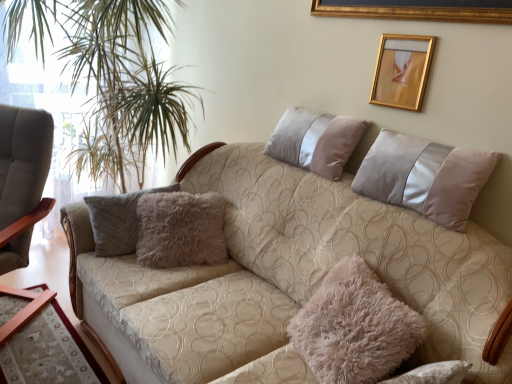
Question: Is gold metallic picture frame at upper right to the left of silky beige pillow at upper right, the 2th pillow in the bottom-to-top sequence, from the viewer's perspective?

Choices:
 (A) no
 (B) yes

Answer: (B)

Question: Is gold metallic picture frame at upper right not within silky beige pillow at upper right, the 2th pillow in the bottom-to-top sequence?

Choices:
 (A) no
 (B) yes

Answer: (B)

Question: Does gold metallic picture frame at upper right come behind silky beige pillow at upper right, the 2th pillow in the bottom-to-top sequence?

Choices:
 (A) yes
 (B) no

Answer: (A)

Question: From a real-world perspective, is gold metallic picture frame at upper right under silky beige pillow at upper right, positioned as the 1th pillow in top-to-bottom order?

Choices:
 (A) no
 (B) yes

Answer: (A)

Question: From the image's perspective, is gold metallic picture frame at upper right beneath silky beige pillow at upper right, positioned as the 1th pillow in top-to-bottom order?

Choices:
 (A) no
 (B) yes

Answer: (A)

Question: From the image's perspective, does gold metallic picture frame at upper right appear higher than silky beige pillow at upper right, the 2th pillow in the bottom-to-top sequence?

Choices:
 (A) no
 (B) yes

Answer: (B)

Question: Is beige fabric couch at center not close to matte gray armchair at left?

Choices:
 (A) no
 (B) yes

Answer: (A)

Question: Can you confirm if beige fabric couch at center is wider than matte gray armchair at left?

Choices:
 (A) no
 (B) yes

Answer: (B)

Question: Can we say beige fabric couch at center lies outside matte gray armchair at left?

Choices:
 (A) yes
 (B) no

Answer: (A)

Question: From a real-world perspective, is beige fabric couch at center under matte gray armchair at left?

Choices:
 (A) yes
 (B) no

Answer: (A)

Question: Is matte gray armchair at left a part of beige fabric couch at center?

Choices:
 (A) yes
 (B) no

Answer: (B)

Question: Is beige fabric couch at center facing towards matte gray armchair at left?

Choices:
 (A) no
 (B) yes

Answer: (A)

Question: From a real-world perspective, is silky beige pillow at upper right, the 2th pillow in the bottom-to-top sequence, positioned over green leafy plant at left based on gravity?

Choices:
 (A) no
 (B) yes

Answer: (B)